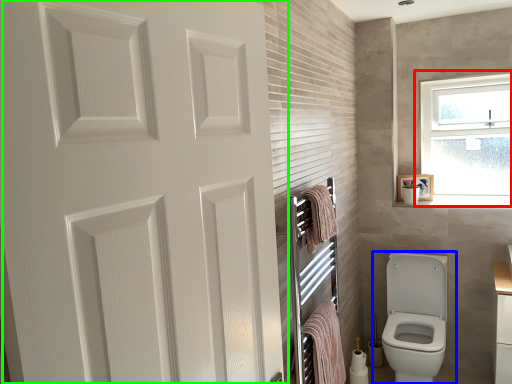
Question: Considering the real-world distances, which object is closest to window (highlighted by a red box)? toilet (highlighted by a blue box) or door (highlighted by a green box).

Choices:
 (A) toilet
 (B) door

Answer: (A)